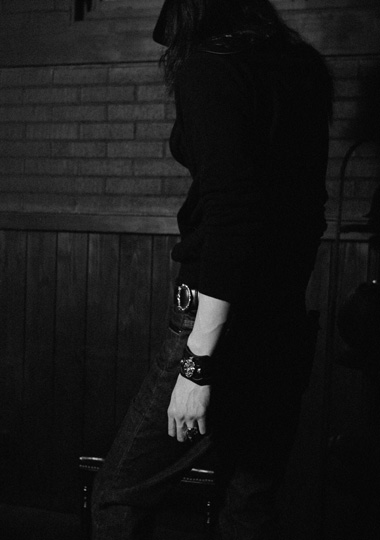
Find the location of a particular element. wall is located at coordinates (121, 314).